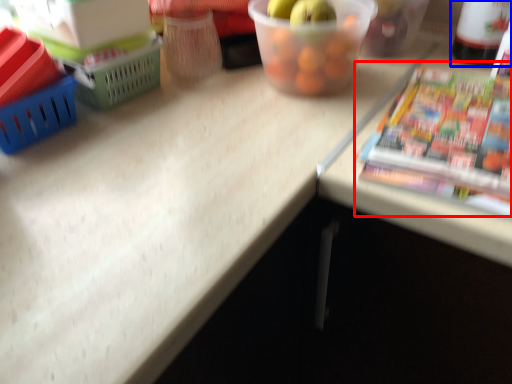
Question: Among these objects, which one is farthest to the camera, paperback book (highlighted by a red box) or bottle (highlighted by a blue box)?

Choices:
 (A) paperback book
 (B) bottle

Answer: (B)